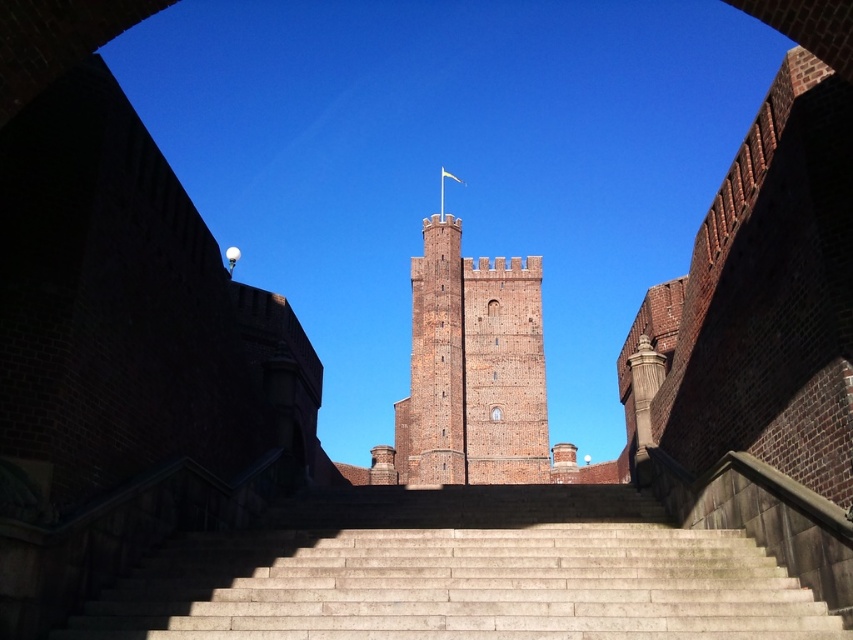
Question: Which point appears closest to the camera in this image?

Choices:
 (A) (492, 461)
 (B) (415, 506)

Answer: (B)

Question: Can you confirm if smooth stone stairs at center is positioned below brick tower at center?

Choices:
 (A) yes
 (B) no

Answer: (A)

Question: Can you confirm if smooth stone stairs at center is positioned to the left of brick tower at center?

Choices:
 (A) no
 (B) yes

Answer: (B)

Question: Is smooth stone stairs at center bigger than brick tower at center?

Choices:
 (A) yes
 (B) no

Answer: (B)

Question: Which object appears closest to the camera in this image?

Choices:
 (A) brick tower at center
 (B) smooth stone stairs at center

Answer: (B)